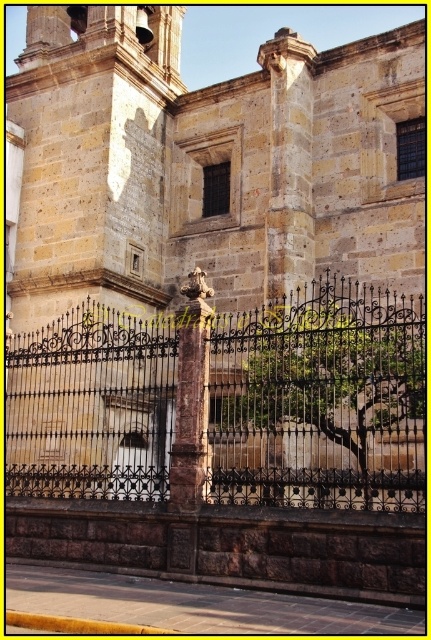
Does iron/blackened metal fence at center have a larger size compared to green leafy tree at center?

Indeed, iron/blackened metal fence at center has a larger size compared to green leafy tree at center.

Does iron/blackened metal fence at center have a lesser width compared to green leafy tree at center?

No.

The height and width of the screenshot is (640, 431). Describe the element at coordinates (227, 403) in the screenshot. I see `iron/blackened metal fence at center` at that location.

You are a GUI agent. You are given a task and a screenshot of the screen. Output one action in this format:
    pyautogui.click(x=<x>, y=<y>)
    Task: Click on the iron/blackened metal fence at center
    
    Given the screenshot: What is the action you would take?
    pyautogui.click(x=227, y=403)